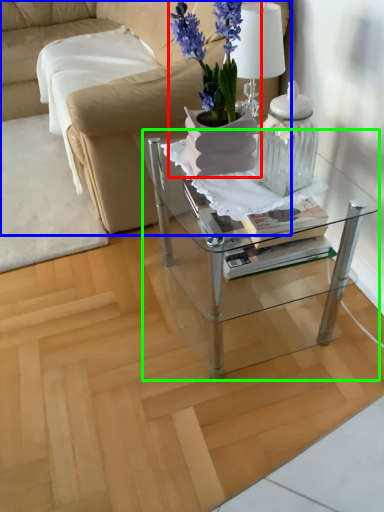
Question: Which object is the closest to the houseplant (highlighted by a red box)? Choose among these: studio couch (highlighted by a blue box) or table (highlighted by a green box).

Choices:
 (A) studio couch
 (B) table

Answer: (B)